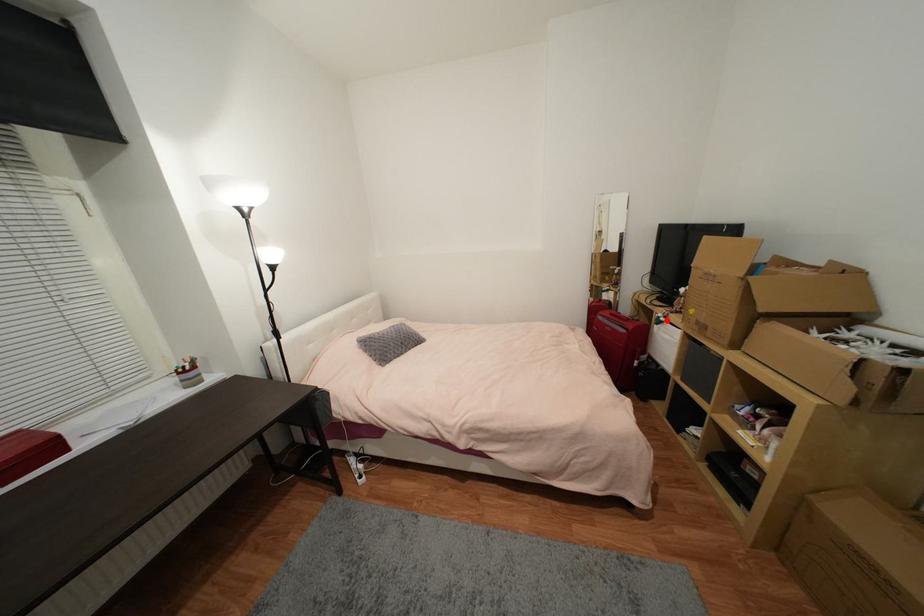
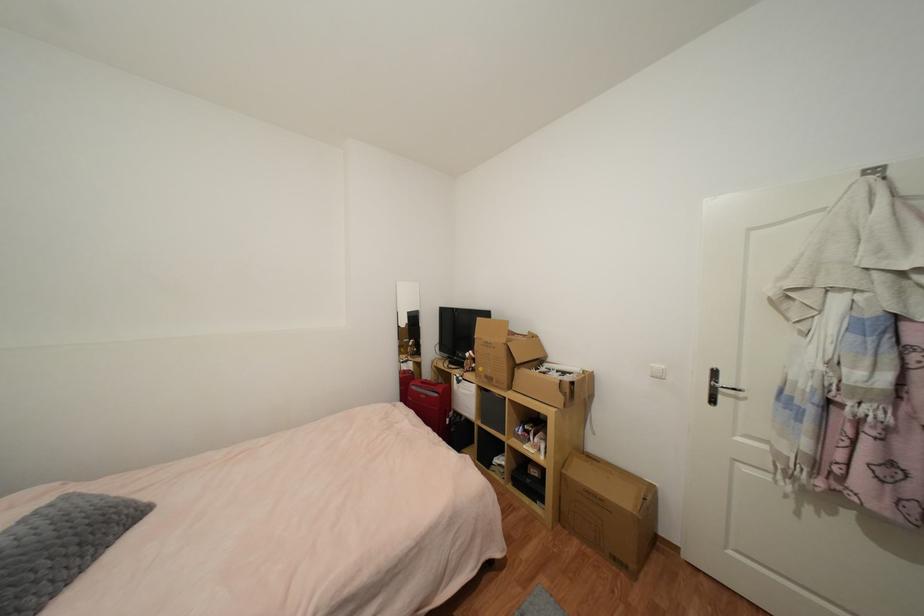
The point at the highlighted location is marked in the first image. Where is the corresponding point in the second image?

(465, 379)